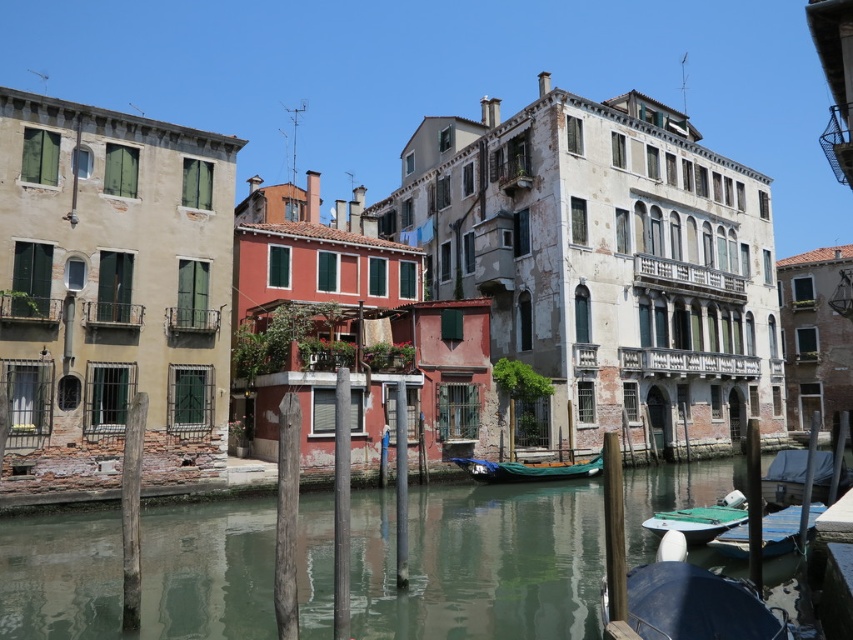
Question: Which object is the closest to the blue tarpaulin boat at lower right?

Choices:
 (A) green canvas boat at lower right
 (B) green matte boat at lower right

Answer: (A)

Question: Can you confirm if greenish water at center is positioned to the right of green canvas boat at lower right?

Choices:
 (A) yes
 (B) no

Answer: (B)

Question: Is blue tarpaulin boat at lower right behind green canvas boat at lower right?

Choices:
 (A) no
 (B) yes

Answer: (A)

Question: Which point is farther to the camera?

Choices:
 (A) blue tarpaulin boat at lower right
 (B) greenish water at center
 (C) green matte boat at lower right

Answer: (C)

Question: Estimate the real-world distances between objects in this image. Which object is farther from the green matte boat at lower right?

Choices:
 (A) green canvas boat at center
 (B) greenish water at center
 (C) green canvas boat at lower right

Answer: (A)

Question: Can you confirm if blue tarpaulin boat at lower right is bigger than green canvas boat at lower right?

Choices:
 (A) no
 (B) yes

Answer: (B)